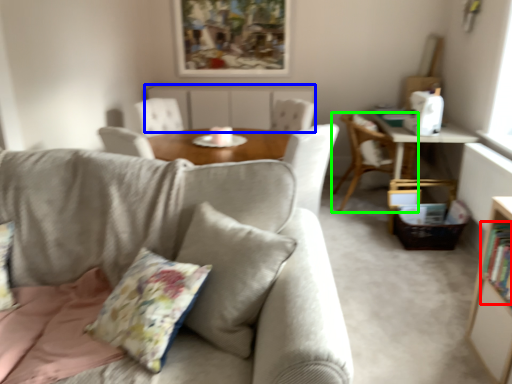
Question: Which object is the closest to the book (highlighted by a red box)? Choose among these: beige (highlighted by a blue box) or chair (highlighted by a green box).

Choices:
 (A) beige
 (B) chair

Answer: (B)